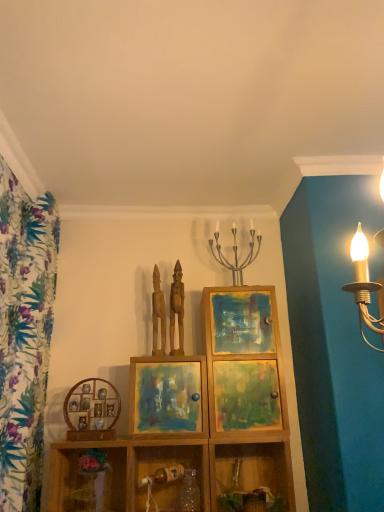
Question: Is point (155, 287) closer or farther from the camera than point (178, 362)?

Choices:
 (A) farther
 (B) closer

Answer: (A)

Question: Considering the positions of wooden statue at center, placed as the second sculpture when sorted from right to left, and matte wooden picture frame at center, the second picture frame when ordered from left to right, in the image, is wooden statue at center, placed as the second sculpture when sorted from right to left, wider or thinner than matte wooden picture frame at center, the second picture frame when ordered from left to right,?

Choices:
 (A) thin
 (B) wide

Answer: (A)

Question: Which object is positioned closest to the matte wooden picture frame at center, the second picture frame when ordered from left to right?

Choices:
 (A) wooden shelf at lower center, which appears as the third shelf when viewed from the left
 (B) wooden statue at center, the 2th sculpture when ordered from left to right
 (C) wooden statue at center, placed as the second sculpture when sorted from right to left
 (D) metallic candle holder at center
 (E) wooden shelf at lower right, which is the fourth shelf in left-to-right order

Answer: (A)

Question: Based on their relative distances, which object is farther from the wooden shelf at lower left, the fourth shelf in the right-to-left sequence?

Choices:
 (A) wooden at center, positioned as the second shelf in left-to-right order
 (B) wooden statue at center, acting as the first sculpture starting from the left
 (C) matte wooden picture frame at center, arranged as the 1th picture frame when viewed from the right
 (D) wooden cabinet at center
 (E) wooden picture frame at center-left, the 2th picture frame viewed from the right

Answer: (D)